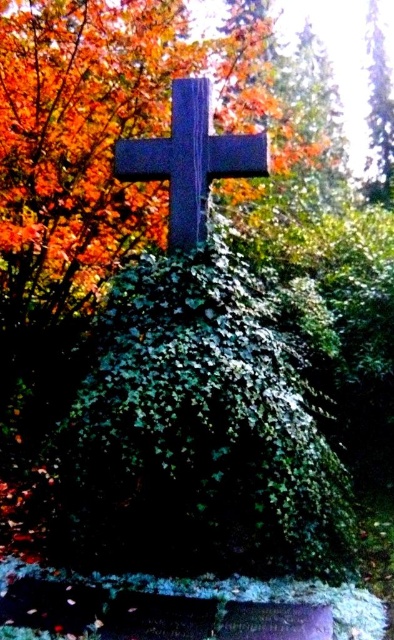
You are a landscape architect designing a garden path that needs to pass between the green leafy bush at center and the dark gray stone cross at center. Which object should you consider for height adjustments to ensure the path remains level?

The green leafy bush at center is taller than the dark gray stone cross at center. To maintain a level path, you should consider trimming the green leafy bush at center to reduce its height or raising the cross to match the bush height.

You are standing in the outdoor setting and want to place a small flag at the point closer to you between point (167, 285) and point (143, 179). Which point should you choose?

You should choose point (167, 285) because it is closer to you than point (143, 179).

You are a photographer planning to take a picture of the dark gray stone cross at center and the green leafy tree at upper right. Which object will appear closer to the camera in the final photo?

The dark gray stone cross at center will appear closer to the camera in the final photo because it is positioned in front of the green leafy tree at upper right.